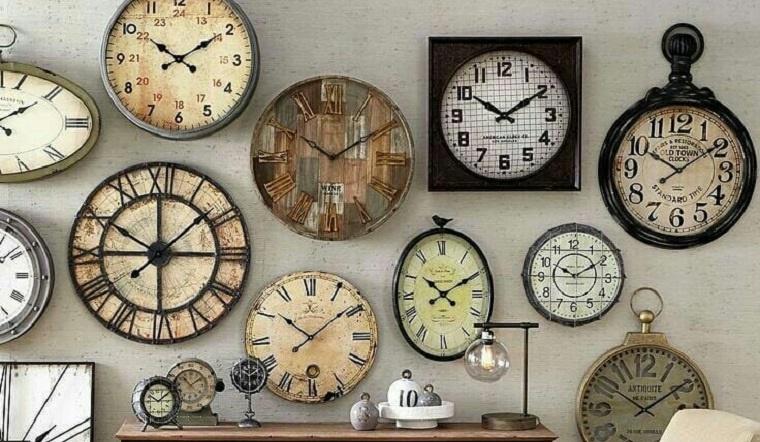
Where is `decorative items on desk`? The width and height of the screenshot is (760, 442). decorative items on desk is located at coordinates (362, 411), (404, 385), (429, 396), (420, 416), (495, 359).